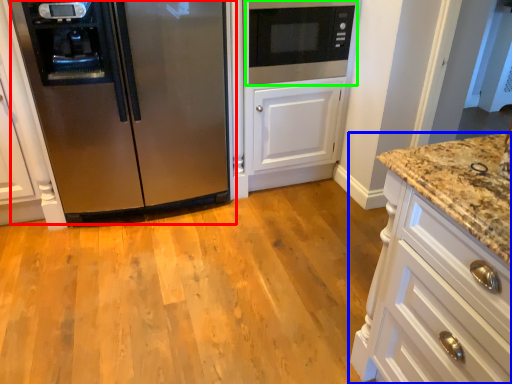
Question: Estimate the real-world distances between objects in this image. Which object is farther from refrigerator (highlighted by a red box), cabinetry (highlighted by a blue box) or microwave oven (highlighted by a green box)?

Choices:
 (A) cabinetry
 (B) microwave oven

Answer: (A)